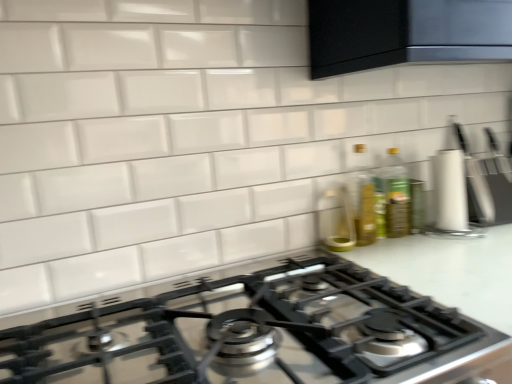
Question: Does green glass bottle at upper right, which is counted as the 1th bottle, starting from the right, have a greater height compared to white glossy countertop at center?

Choices:
 (A) yes
 (B) no

Answer: (B)

Question: From a real-world perspective, is green glass bottle at upper right, which ranks as the second bottle in left-to-right order, located higher than white glossy countertop at center?

Choices:
 (A) yes
 (B) no

Answer: (A)

Question: Can you confirm if green glass bottle at upper right, which ranks as the second bottle in left-to-right order, is shorter than white glossy countertop at center?

Choices:
 (A) yes
 (B) no

Answer: (A)

Question: From the image's perspective, is green glass bottle at upper right, which is counted as the 1th bottle, starting from the right, under white glossy countertop at center?

Choices:
 (A) yes
 (B) no

Answer: (B)

Question: Could you tell me if green glass bottle at upper right, which is counted as the 1th bottle, starting from the right, is turned towards white glossy countertop at center?

Choices:
 (A) yes
 (B) no

Answer: (B)

Question: Is point (344, 221) positioned closer to the camera than point (467, 162)?

Choices:
 (A) farther
 (B) closer

Answer: (B)

Question: Would you say clear glass bottle at center is to the left or to the right of white matte knife block at right in the picture?

Choices:
 (A) right
 (B) left

Answer: (B)

Question: Considering the positions of clear glass bottle at center and white matte knife block at right in the image, is clear glass bottle at center taller or shorter than white matte knife block at right?

Choices:
 (A) tall
 (B) short

Answer: (B)

Question: From a real-world perspective, is clear glass bottle at center physically located above or below white matte knife block at right?

Choices:
 (A) below
 (B) above

Answer: (A)

Question: Is point (391, 195) closer or farther from the camera than point (350, 205)?

Choices:
 (A) farther
 (B) closer

Answer: (B)

Question: Looking at their shapes, would you say green glass bottle at upper right, which ranks as the second bottle in left-to-right order, is wider or thinner than clear glass bottle at center?

Choices:
 (A) thin
 (B) wide

Answer: (A)

Question: Would you say green glass bottle at upper right, which ranks as the second bottle in left-to-right order, is to the left or to the right of clear glass bottle at center in the picture?

Choices:
 (A) right
 (B) left

Answer: (A)

Question: Considering their positions, is green glass bottle at upper right, which is counted as the 1th bottle, starting from the right, located in front of or behind clear glass bottle at center?

Choices:
 (A) behind
 (B) front

Answer: (A)

Question: Considering the positions of clear glass bottle at center and green glass bottle at upper right, which ranks as the second bottle in left-to-right order, in the image, is clear glass bottle at center taller or shorter than green glass bottle at upper right, which ranks as the second bottle in left-to-right order,?

Choices:
 (A) tall
 (B) short

Answer: (B)

Question: Considering the relative positions of clear glass bottle at center and green glass bottle at upper right, which ranks as the second bottle in left-to-right order, in the image provided, is clear glass bottle at center to the left or to the right of green glass bottle at upper right, which ranks as the second bottle in left-to-right order,?

Choices:
 (A) left
 (B) right

Answer: (A)